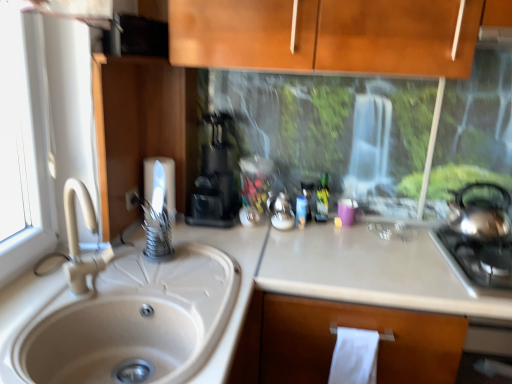
Identify the location of empty space that is to the right of metallic silver kettle at center. The image size is (512, 384). 326,231.